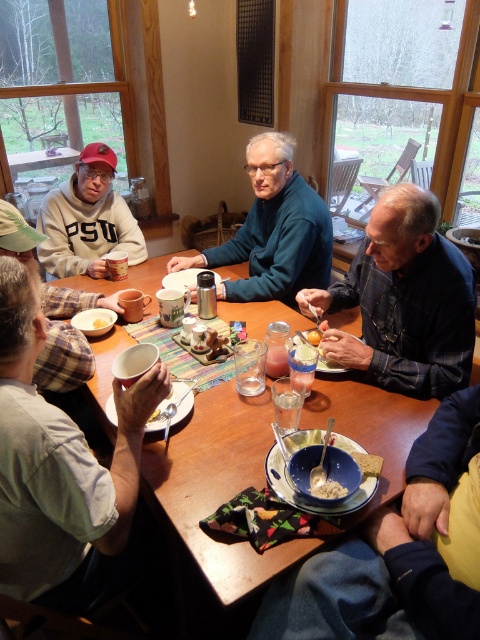
You are a person sitting at the dining table and want to reach the white crumbly food at center from your current position near the matte gray sweatshirt at left. Can you comfortably stretch your arm to grab it without moving your chair?

The distance between the matte gray sweatshirt at left and the white crumbly food at center is 5.67 feet. Since this distance is greater than the typical human arm length of around 2.5 feet, you cannot comfortably reach it without moving your chair.

You are a waiter in a restaurant and you need to deliver a dessert to the table. The dessert must be placed exactly 36 inches away from the plaid fabric shirt at lower left. Is the current position of the white crumbly food at center suitable for placing the dessert?

The plaid fabric shirt at lower left is 34.68 inches away from white crumbly food at center. Since the required distance is 36 inches, the white crumbly food at center is slightly closer than needed, so it is not suitable for placing the dessert.

You are a guest at this gathering and want to place your phone on the table without covering any dishes. Given the plaid fabric shirt at lower left and the white matte bowl at center, which object should you avoid placing your phone on because it is taller?

You should avoid placing your phone on the plaid fabric shirt at lower left because it is taller than the white matte bowl at center, so it might not be a flat surface for the phone.